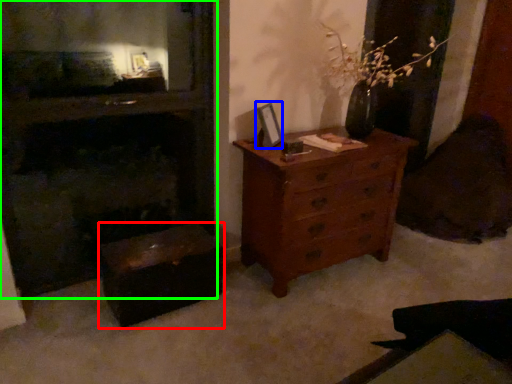
Question: Which is farther away from vanity (highlighted by a red box)? picture frame (highlighted by a blue box) or fireplace (highlighted by a green box)?

Choices:
 (A) picture frame
 (B) fireplace

Answer: (A)